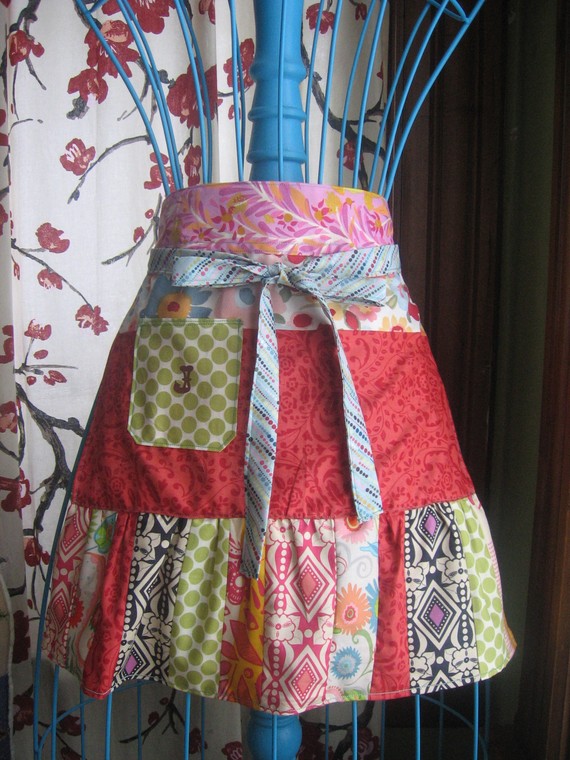
Where is `stand`? stand is located at coordinates (280, 743).